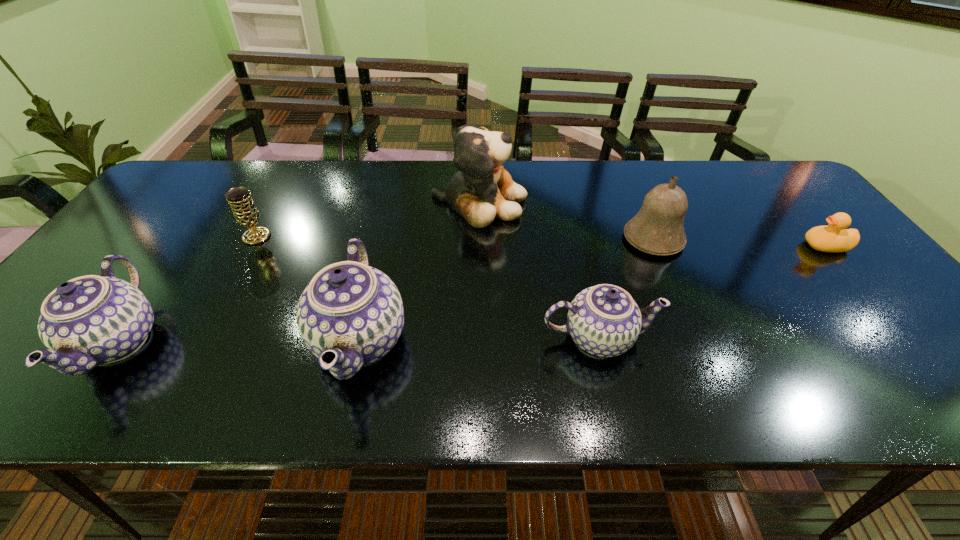
Identify the location of free space that satisfies the following two spatial constraints: 1. at the face of the bell; 2. on the right side of the puppy. Image resolution: width=960 pixels, height=540 pixels. (479, 239).

Where is `free spot that satisfies the following two spatial constraints: 1. at the spout of the shortest chinaware; 2. at the spout of the leftmost object`? The height and width of the screenshot is (540, 960). free spot that satisfies the following two spatial constraints: 1. at the spout of the shortest chinaware; 2. at the spout of the leftmost object is located at coordinates (600, 342).

Locate an element on the screen. free space that satisfies the following two spatial constraints: 1. at the spout of the rightmost chinaware; 2. at the spout of the third object from left to right is located at coordinates (599, 340).